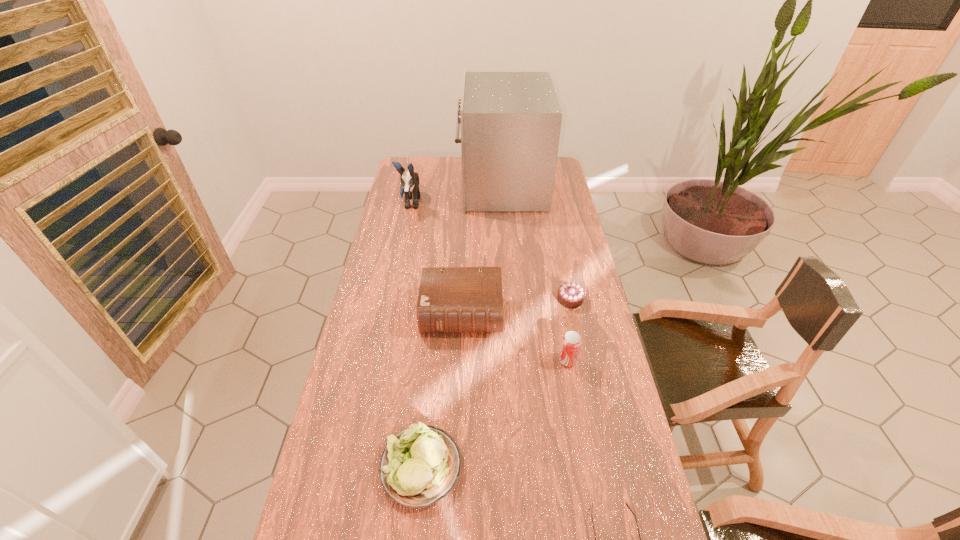
Image resolution: width=960 pixels, height=540 pixels. I want to click on vacant space in between the Bible and the sixth shortest object, so click(436, 258).

Locate an element on the screen. The width and height of the screenshot is (960, 540). empty space that is in between the second shortest object and the Bible is located at coordinates [516, 306].

At what (x,y) coordinates should I click in order to perform the action: click on object that is the fifth closest to the shortest object. Please return your answer as a coordinate pair (x, y). Looking at the image, I should click on (510, 122).

The width and height of the screenshot is (960, 540). Identify the location of the sixth closest object to the sunglasses. (410, 181).

This screenshot has height=540, width=960. I want to click on free space in the image that satisfies the following two spatial constraints: 1. on the back side of the chocolate cake; 2. on the right side of the third shortest object, so click(x=438, y=299).

Locate an element on the screen. This screenshot has height=540, width=960. vacant space that satisfies the following two spatial constraints: 1. on the back side of the chocolate cake; 2. on the front panel of the tallest object is located at coordinates (546, 186).

You are a GUI agent. You are given a task and a screenshot of the screen. Output one action in this format:
    pyautogui.click(x=<x>, y=<y>)
    Task: Click on the vacant space that satisfies the following two spatial constraints: 1. on the front panel of the toaster oven; 2. on the back side of the second shortest object
    
    Given the screenshot: What is the action you would take?
    [x=510, y=299]

Image resolution: width=960 pixels, height=540 pixels. I want to click on free space in the image that satisfies the following two spatial constraints: 1. on the back side of the second shortest object; 2. on the front panel of the tallest object, so click(x=546, y=186).